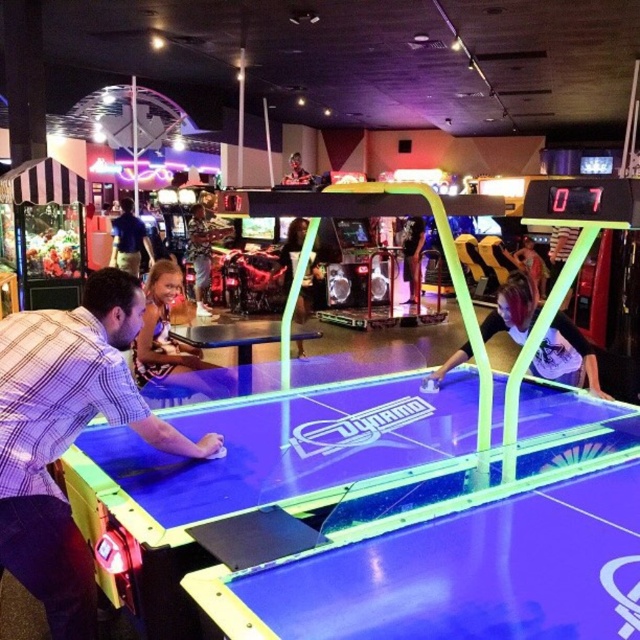
Question: Does blue shirt at center have a smaller size compared to dark brown leather jacket at center?

Choices:
 (A) no
 (B) yes

Answer: (A)

Question: Which object is closer to the camera taking this photo?

Choices:
 (A) camouflage shirt at center
 (B) dark brown leather jacket at center
 (C) shiny silver helmet at center

Answer: (B)

Question: Is matte purple shirt at center to the left of blue shirt at center from the viewer's perspective?

Choices:
 (A) yes
 (B) no

Answer: (B)

Question: Does matte purple shirt at center lie in front of smooth skin face at upper center?

Choices:
 (A) no
 (B) yes

Answer: (B)

Question: Which object is the farthest from the plaid shirt at left?

Choices:
 (A) shiny silver helmet at center
 (B) matte black shirt at center

Answer: (A)

Question: Which point appears closest to the camera in this image?

Choices:
 (A) (196, 296)
 (B) (131, 257)
 (C) (304, 173)
 (D) (307, 282)

Answer: (D)